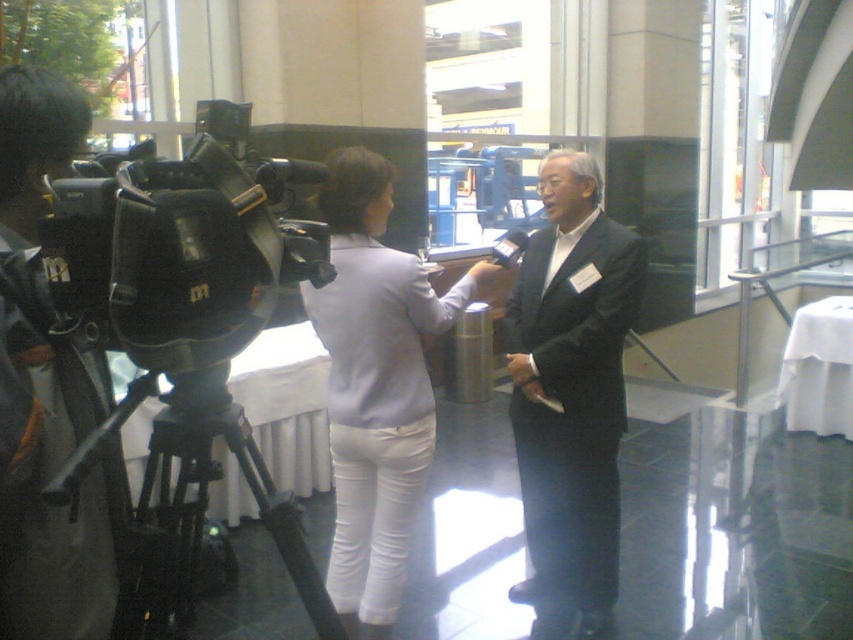
Identify the location of light purple fabric jacket at center. The image size is (853, 640). (376, 387).

Looking at this image, can you confirm if light purple fabric jacket at center is positioned to the right of matte black camera at left?

Indeed, light purple fabric jacket at center is positioned on the right side of matte black camera at left.

Image resolution: width=853 pixels, height=640 pixels. I want to click on light purple fabric jacket at center, so [x=376, y=387].

Can you confirm if black plastic video camera at left is smaller than matte black camera at left?

Incorrect, black plastic video camera at left is not smaller in size than matte black camera at left.

Is black plastic video camera at left taller than matte black camera at left?

Yes.

The width and height of the screenshot is (853, 640). What are the coordinates of `black plastic video camera at left` in the screenshot? It's located at (184, 323).

Is black plastic video camera at left further to camera compared to black matte tripod at lower left?

No, it is in front of black matte tripod at lower left.

Which is in front, point (170, 362) or point (78, 477)?

Point (78, 477) is more forward.

Between point (183, 200) and point (128, 400), which one is positioned behind?

The point (128, 400) is more distant.

Find the location of a particular element. The height and width of the screenshot is (640, 853). black plastic video camera at left is located at coordinates (184, 323).